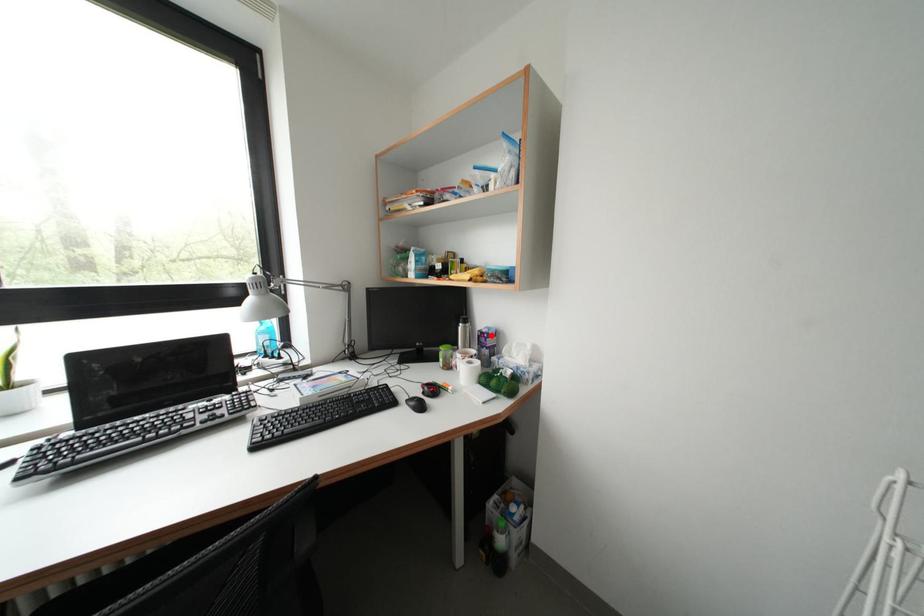
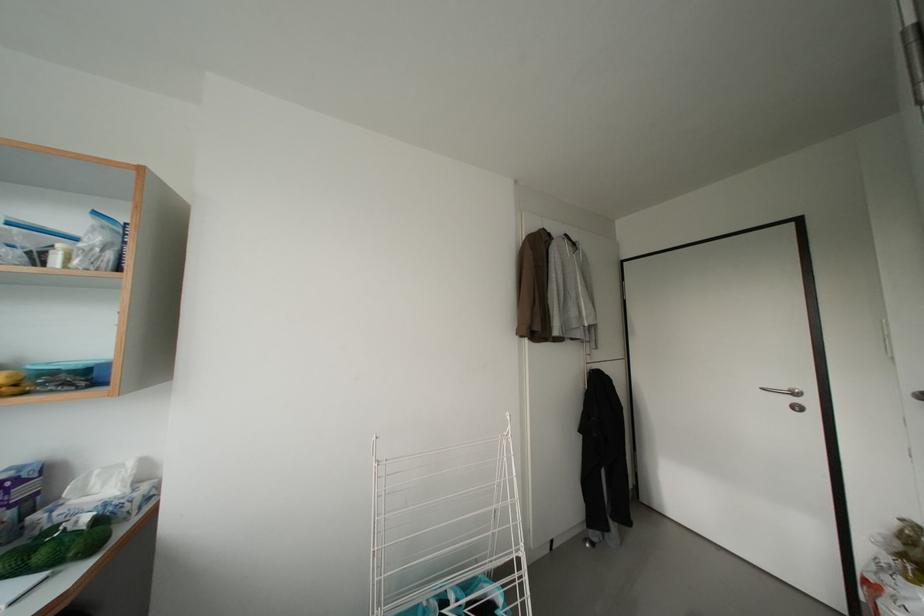
Question: I am providing you with two images of the same scene from different viewpoints. A red point is shown in image1. For the corresponding object point in image2, is it positioned nearer or farther from the camera?

Choices:
 (A) Nearer
 (B) Farther

Answer: (A)